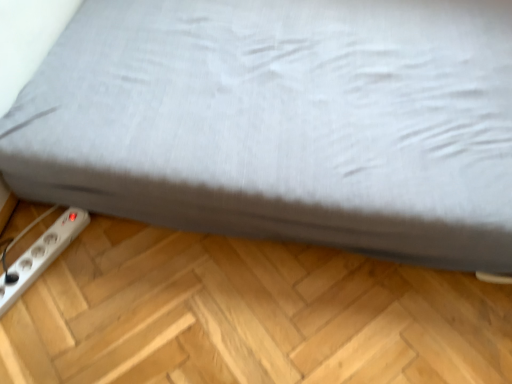
Question: Considering their positions, is white plastic power plugs and sockets at lower left located in front of or behind gray fabric bed at lower left?

Choices:
 (A) behind
 (B) front

Answer: (A)

Question: Would you say white plastic power plugs and sockets at lower left is to the left or to the right of gray fabric bed at lower left in the picture?

Choices:
 (A) left
 (B) right

Answer: (A)

Question: Looking at the image, does white plastic power plugs and sockets at lower left seem bigger or smaller compared to gray fabric bed at lower left?

Choices:
 (A) big
 (B) small

Answer: (B)

Question: Choose the correct answer: Is gray fabric bed at lower left inside white plastic power plugs and sockets at lower left or outside it?

Choices:
 (A) inside
 (B) outside

Answer: (B)

Question: Considering the positions of gray fabric bed at lower left and white plastic power plugs and sockets at lower left in the image, is gray fabric bed at lower left wider or thinner than white plastic power plugs and sockets at lower left?

Choices:
 (A) wide
 (B) thin

Answer: (A)

Question: Does point (506, 127) appear closer or farther from the camera than point (53, 253)?

Choices:
 (A) closer
 (B) farther

Answer: (B)

Question: In terms of size, does gray fabric bed at lower left appear bigger or smaller than white plastic power plugs and sockets at lower left?

Choices:
 (A) big
 (B) small

Answer: (A)